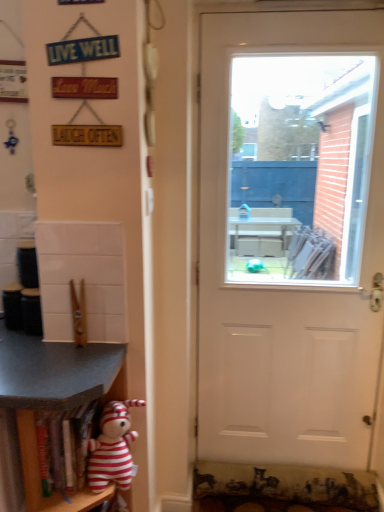
Question: Is wooden shelf at lower left, which appears as the 1th shelf when viewed from the left, bigger or smaller than wooden bookshelf at lower left, arranged as the second shelf when viewed from the left?

Choices:
 (A) big
 (B) small

Answer: (A)

Question: In terms of height, does wooden shelf at lower left, the second shelf from the right, look taller or shorter compared to wooden bookshelf at lower left, the 1th shelf viewed from the right?

Choices:
 (A) tall
 (B) short

Answer: (A)

Question: Which is nearer to the striped plush toy at lower left?

Choices:
 (A) white matte door at center
 (B) wooden bookshelf at lower left, arranged as the second shelf when viewed from the left
 (C) wooden shelf at lower left, the second shelf from the right

Answer: (B)

Question: Which object is the farthest from the wooden shelf at lower left, which appears as the 1th shelf when viewed from the left?

Choices:
 (A) white matte door at center
 (B) striped plush toy at lower left
 (C) wooden bookshelf at lower left, arranged as the second shelf when viewed from the left

Answer: (A)